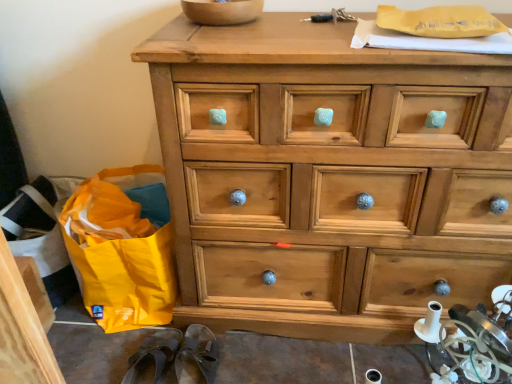
Question: Is brown leather slipper at lower left, the first slipper in the left-to-right sequence, smaller than wooden bowl at upper center?

Choices:
 (A) no
 (B) yes

Answer: (A)

Question: Is brown leather slipper at lower left, the first slipper in the left-to-right sequence, bigger than wooden bowl at upper center?

Choices:
 (A) yes
 (B) no

Answer: (A)

Question: Considering the relative sizes of brown leather slipper at lower left, the second slipper in the right-to-left sequence, and wooden bowl at upper center in the image provided, is brown leather slipper at lower left, the second slipper in the right-to-left sequence, taller than wooden bowl at upper center?

Choices:
 (A) yes
 (B) no

Answer: (A)

Question: Considering the relative positions of brown leather slipper at lower left, the second slipper in the right-to-left sequence, and wooden bowl at upper center in the image provided, is brown leather slipper at lower left, the second slipper in the right-to-left sequence, behind wooden bowl at upper center?

Choices:
 (A) no
 (B) yes

Answer: (B)

Question: Does brown leather slipper at lower left, the first slipper in the left-to-right sequence, appear on the right side of wooden bowl at upper center?

Choices:
 (A) no
 (B) yes

Answer: (A)

Question: Considering the positions of point (241, 21) and point (133, 274), is point (241, 21) closer or farther from the camera than point (133, 274)?

Choices:
 (A) closer
 (B) farther

Answer: (A)

Question: Based on their positions, is wooden bowl at upper center located to the left or right of yellow fabric bag at lower left?

Choices:
 (A) right
 (B) left

Answer: (A)

Question: Looking at the image, does wooden bowl at upper center seem bigger or smaller compared to yellow fabric bag at lower left?

Choices:
 (A) big
 (B) small

Answer: (B)

Question: In terms of height, does wooden bowl at upper center look taller or shorter compared to yellow fabric bag at lower left?

Choices:
 (A) tall
 (B) short

Answer: (B)

Question: Looking at the image, does brown leather slipper at lower center, which ranks as the 2th slipper in left-to-right order, seem bigger or smaller compared to brown leather slipper at lower left, the second slipper in the right-to-left sequence?

Choices:
 (A) small
 (B) big

Answer: (B)

Question: Considering the positions of point (178, 370) and point (125, 377), is point (178, 370) closer or farther from the camera than point (125, 377)?

Choices:
 (A) closer
 (B) farther

Answer: (B)

Question: Is brown leather slipper at lower center, acting as the first slipper starting from the right, wider or thinner than brown leather slipper at lower left, the first slipper in the left-to-right sequence?

Choices:
 (A) wide
 (B) thin

Answer: (A)

Question: Would you say brown leather slipper at lower center, which ranks as the 2th slipper in left-to-right order, is to the left or to the right of brown leather slipper at lower left, the first slipper in the left-to-right sequence, in the picture?

Choices:
 (A) right
 (B) left

Answer: (A)

Question: From a real-world perspective, is brown leather slipper at lower left, the first slipper in the left-to-right sequence, physically located above or below yellow fabric bag at lower left?

Choices:
 (A) below
 (B) above

Answer: (A)

Question: Is point (146, 365) closer or farther from the camera than point (163, 203)?

Choices:
 (A) closer
 (B) farther

Answer: (A)